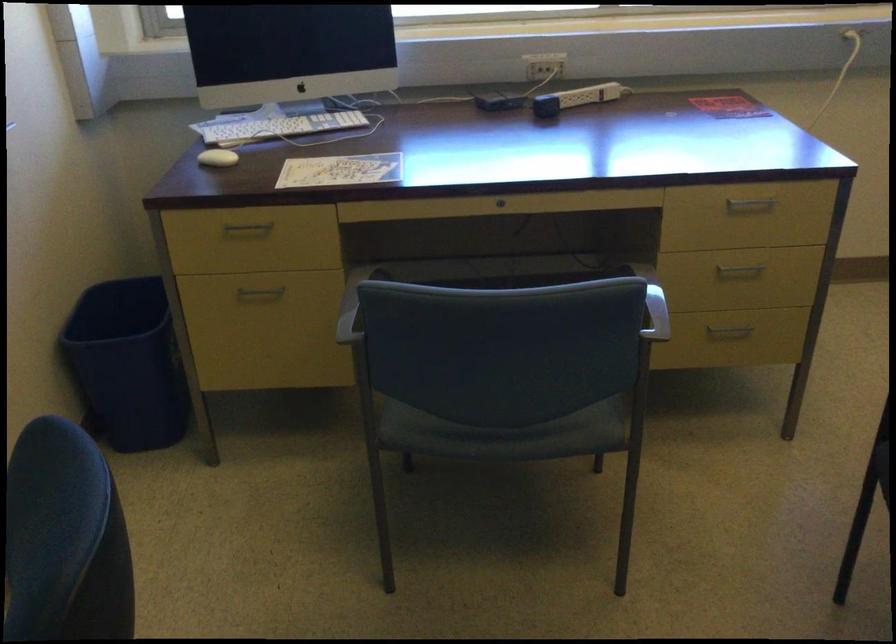
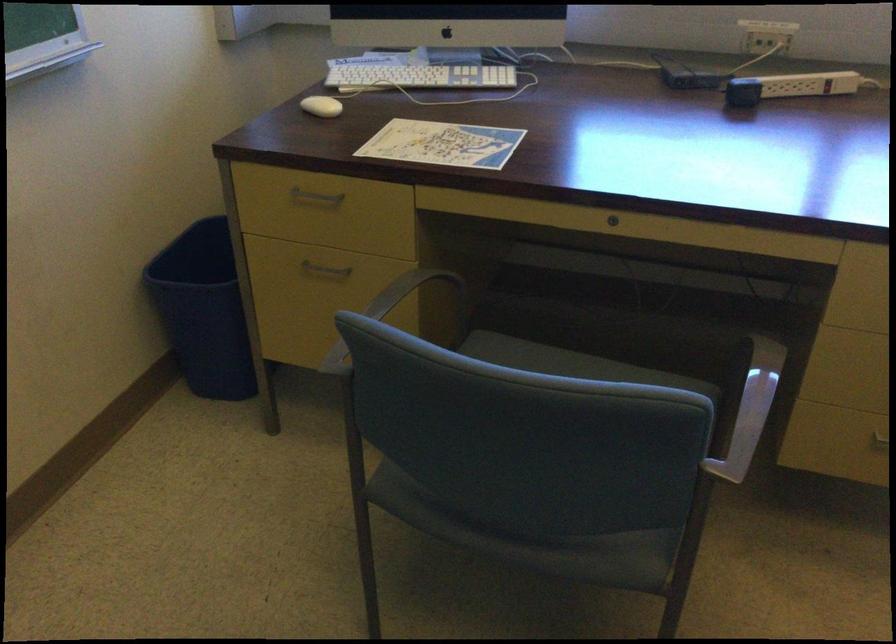
In the second image, find the point that corresponds to the point at 655,299 in the first image.

(750, 410)